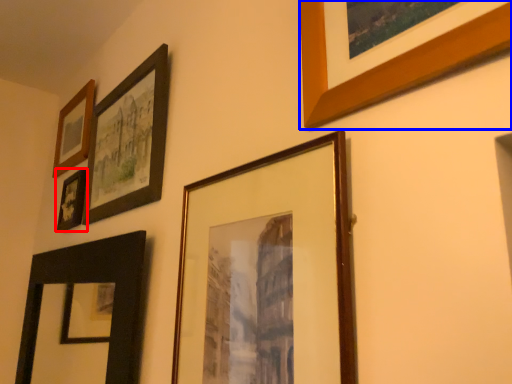
Question: Which of the following is the closest to the observer, picture frame (highlighted by a red box) or picture frame (highlighted by a blue box)?

Choices:
 (A) picture frame
 (B) picture frame

Answer: (B)